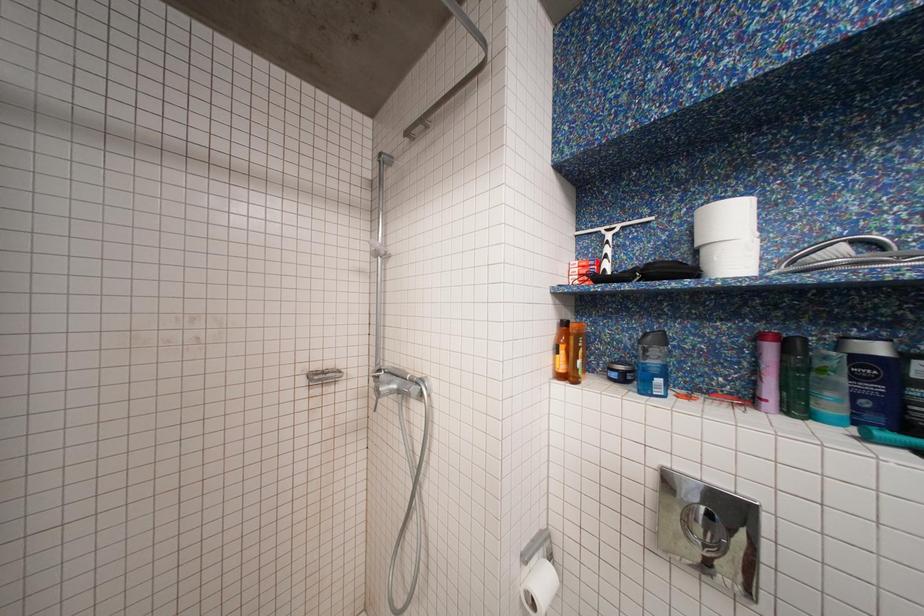
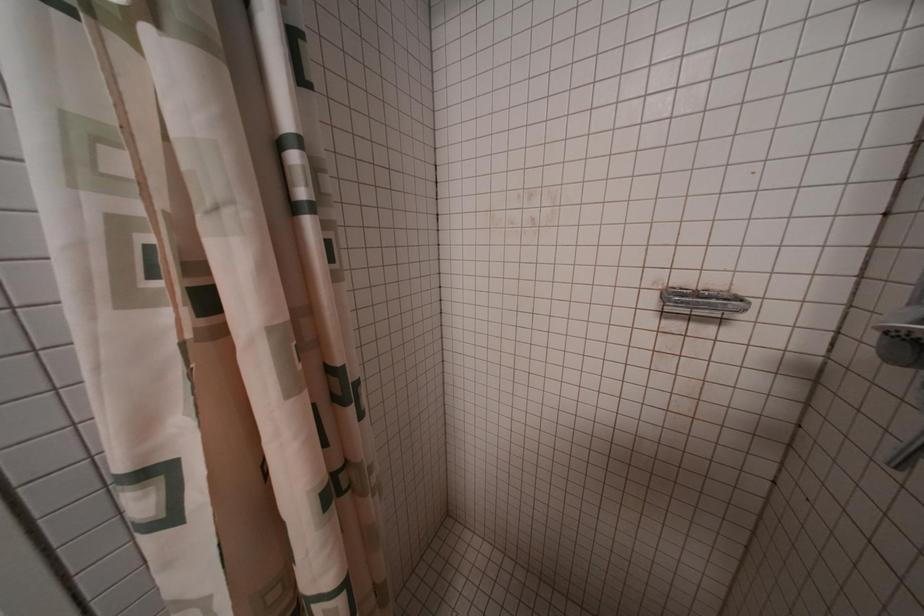
Question: Based on the continuous images, in which direction is the camera rotating? Reply with the corresponding letter.

Choices:
 (A) Left
 (B) Right
 (C) Up
 (D) Down

Answer: (A)